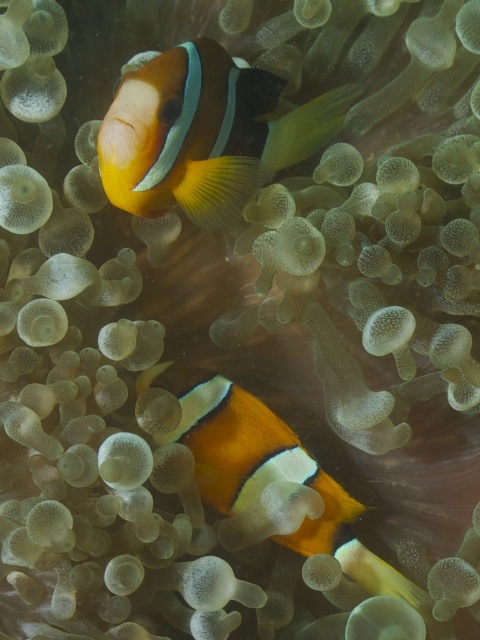
Question: Is orange matte clownfish at upper center below orange matte clownfish at center?

Choices:
 (A) yes
 (B) no

Answer: (B)

Question: Which object appears farthest from the camera in this image?

Choices:
 (A) orange matte clownfish at center
 (B) orange matte clownfish at upper center

Answer: (A)

Question: Does orange matte clownfish at upper center appear under orange matte clownfish at center?

Choices:
 (A) yes
 (B) no

Answer: (B)

Question: From the image, what is the correct spatial relationship of orange matte clownfish at upper center in relation to orange matte clownfish at center?

Choices:
 (A) below
 (B) above

Answer: (B)